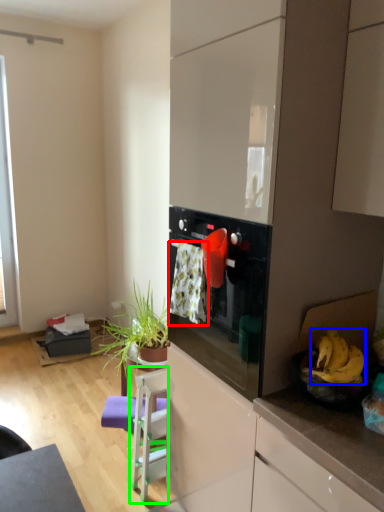
Question: Estimate the real-world distances between objects in this image. Which object is farther from laundry (highlighted by a red box), banana (highlighted by a blue box) or chair (highlighted by a green box)?

Choices:
 (A) banana
 (B) chair

Answer: (B)